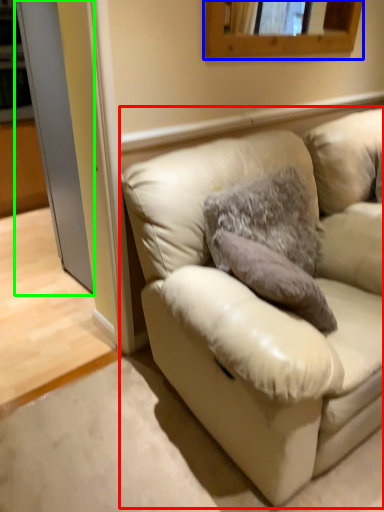
Question: Estimate the real-world distances between objects in this image. Which object is closer to studio couch (highlighted by a red box), mirror (highlighted by a blue box) or glass door (highlighted by a green box)?

Choices:
 (A) mirror
 (B) glass door

Answer: (A)